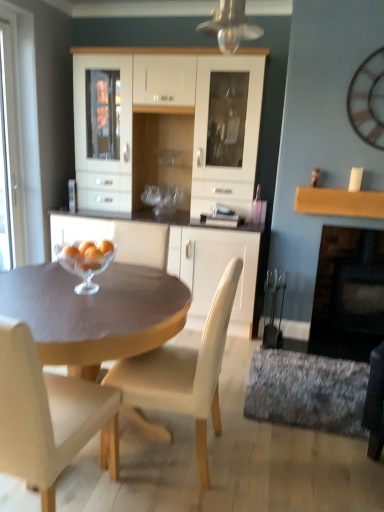
Question: From a real-world perspective, is white leather chair at center, the 2th chair viewed from the left, physically located above or below wooden clock at upper right?

Choices:
 (A) above
 (B) below

Answer: (B)

Question: In terms of height, does white leather chair at center, the 2th chair viewed from the left, look taller or shorter compared to wooden clock at upper right?

Choices:
 (A) short
 (B) tall

Answer: (B)

Question: Which is farther from the matte brown table at center?

Choices:
 (A) white glass door at left
 (B) beige leather chair at center, the 1th chair positioned from the left
 (C) textured gray rug at lower right
 (D) clear glass bowl at center
 (E) wooden clock at upper right

Answer: (E)

Question: Which is farther from the textured gray rug at lower right?

Choices:
 (A) matte brown table at center
 (B) wooden clock at upper right
 (C) beige leather chair at center, the 1th chair positioned from the left
 (D) clear glass bowl at center
 (E) black matte fireplace at right

Answer: (B)